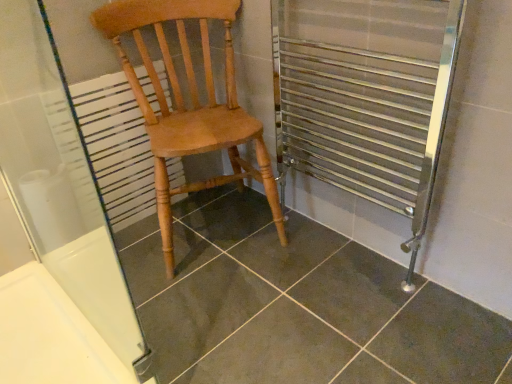
Locate an element on the screen. The height and width of the screenshot is (384, 512). vacant area that lies between light brown wood chair at center and transparent glass screen door at upper left is located at coordinates (173, 296).